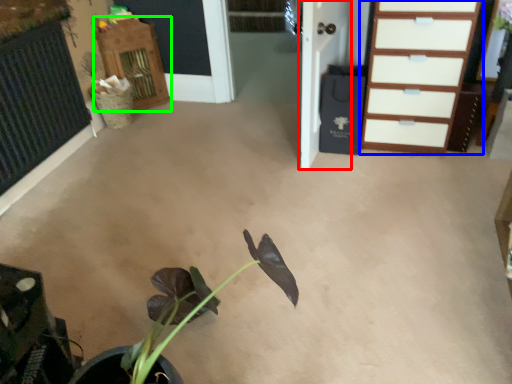
Question: Considering the real-world distances, which object is farthest from door (highlighted by a red box)? chest of drawers (highlighted by a blue box) or dresser (highlighted by a green box)?

Choices:
 (A) chest of drawers
 (B) dresser

Answer: (B)